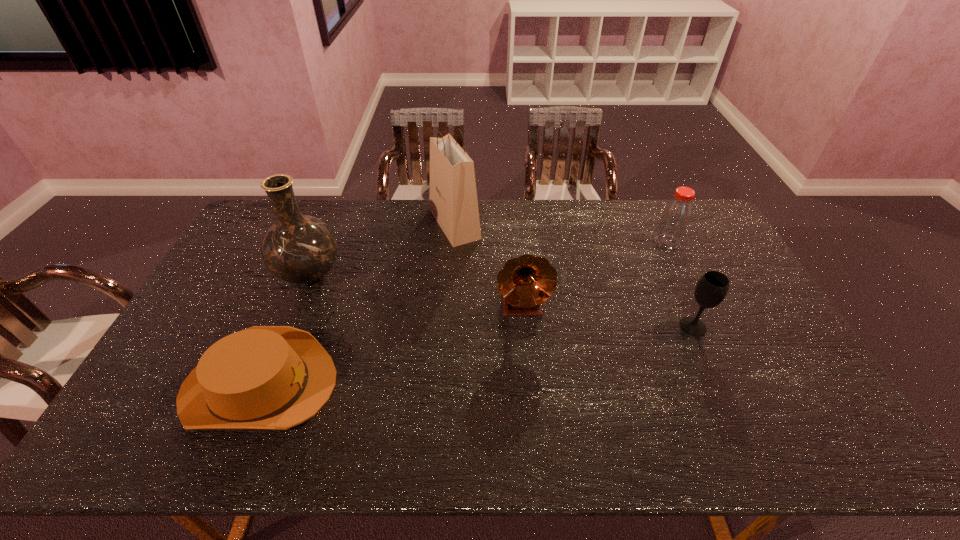
The height and width of the screenshot is (540, 960). I want to click on vacant space at the far edge of the desktop, so click(593, 212).

The width and height of the screenshot is (960, 540). In the image, there is a desktop. Find the location of `vacant space at the near edge`. vacant space at the near edge is located at coordinates (567, 450).

The width and height of the screenshot is (960, 540). In order to click on vacant space at the left edge in this screenshot , I will do `click(157, 378)`.

I want to click on vacant position at the right edge of the desktop, so click(814, 392).

Locate an element on the screen. free space at the far left corner of the desktop is located at coordinates (252, 222).

The width and height of the screenshot is (960, 540). In the image, there is a desktop. Identify the location of vacant space at the near left corner. (133, 424).

Locate an element on the screen. This screenshot has width=960, height=540. free space that is in between the bottle and the vase is located at coordinates (489, 258).

The height and width of the screenshot is (540, 960). Identify the location of vacant area that lies between the shopping bag and the phonograph_record. (489, 265).

The height and width of the screenshot is (540, 960). In order to click on empty location between the fourth object from right to left and the shortest object in this screenshot , I will do [x=357, y=305].

The image size is (960, 540). Find the location of `free space between the bottle and the vase`. free space between the bottle and the vase is located at coordinates (489, 258).